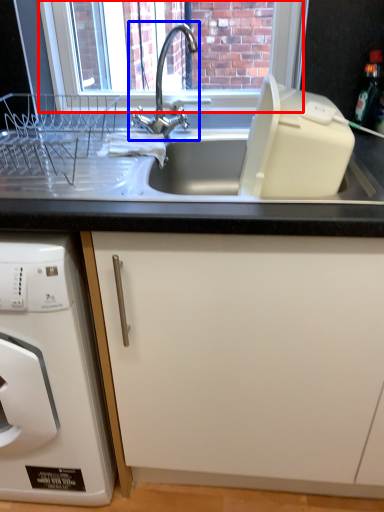
Question: Which object appears farthest to the camera in this image, window screen (highlighted by a red box) or tap (highlighted by a blue box)?

Choices:
 (A) window screen
 (B) tap

Answer: (A)